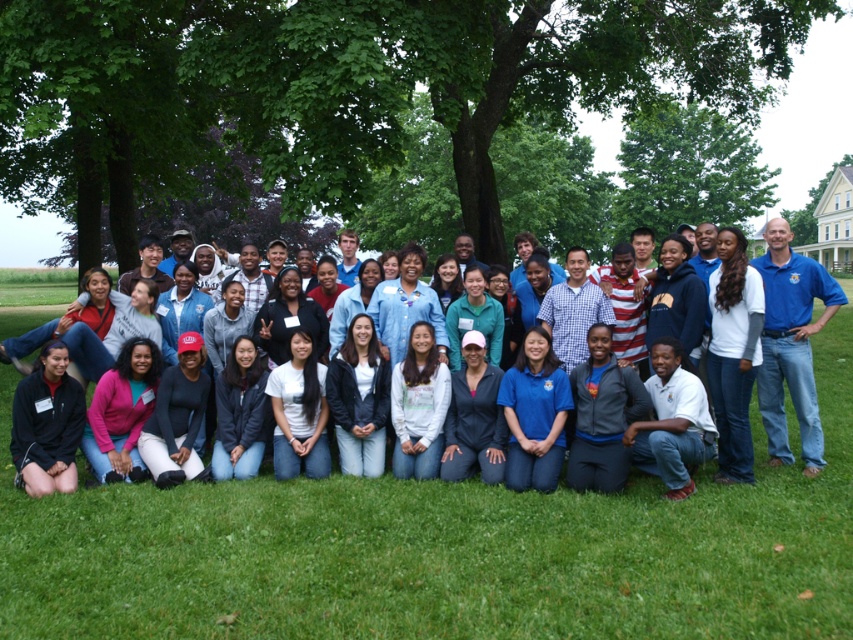
Is green leafy tree at upper center in front of blue shirt at right?

That is False.

Can you confirm if green leafy tree at upper center is positioned to the right of blue shirt at right?

Yes, green leafy tree at upper center is to the right of blue shirt at right.

The image size is (853, 640). What do you see at coordinates (688, 170) in the screenshot?
I see `green leafy tree at upper center` at bounding box center [688, 170].

Identify the location of green leafy tree at upper center. The height and width of the screenshot is (640, 853). (688, 170).

Can you confirm if green leafy tree at upper center is positioned above blue fabric shirt at center?

Yes.

Based on the photo, measure the distance from green leafy tree at upper center to blue fabric shirt at center.

green leafy tree at upper center and blue fabric shirt at center are 42.43 meters apart.

You are a GUI agent. You are given a task and a screenshot of the screen. Output one action in this format:
    pyautogui.click(x=<x>, y=<y>)
    Task: Click on the green leafy tree at upper center
    The width and height of the screenshot is (853, 640).
    Given the screenshot: What is the action you would take?
    pyautogui.click(x=688, y=170)

Is green leafy tree at center shorter than white matte shirt at center?

In fact, green leafy tree at center may be taller than white matte shirt at center.

Can you confirm if green leafy tree at center is positioned to the right of white matte shirt at center?

Incorrect, green leafy tree at center is not on the right side of white matte shirt at center.

Is point (381, 140) less distant than point (734, 401)?

No, it is not.

This screenshot has width=853, height=640. Identify the location of green leafy tree at center. (344, 86).